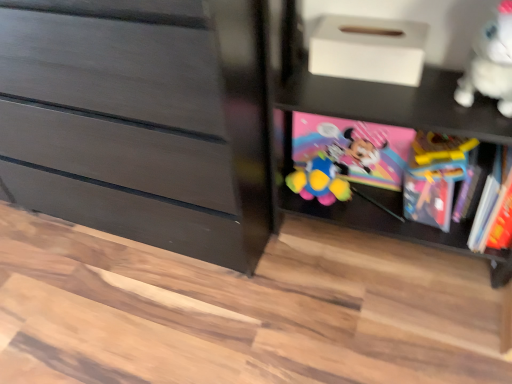
This screenshot has width=512, height=384. Describe the element at coordinates (354, 147) in the screenshot. I see `pink matte minnie mouse book at center, which is the first book from left to right` at that location.

Where is `black matte shelf at lower right`? The width and height of the screenshot is (512, 384). black matte shelf at lower right is located at coordinates (382, 94).

The height and width of the screenshot is (384, 512). Find the location of `translucent plastic book at right, which is the second book from left to right`. translucent plastic book at right, which is the second book from left to right is located at coordinates (434, 176).

At what (x,y) coordinates should I click in order to perform the action: click on matte black dresser at left. Please return your answer as a coordinate pair (x, y). The height and width of the screenshot is (384, 512). Looking at the image, I should click on (141, 128).

Locate an element on the screen. The height and width of the screenshot is (384, 512). pink matte minnie mouse book at center, which is the first book from left to right is located at coordinates (354, 147).

Is point (336, 22) positioned behind point (73, 126)?

Yes, point (336, 22) is behind point (73, 126).

Is white matte shoe box at upper center to the left of matte black dresser at left from the viewer's perspective?

In fact, white matte shoe box at upper center is to the right of matte black dresser at left.

From the image's perspective, between white matte shoe box at upper center and matte black dresser at left, who is located below?

matte black dresser at left.

Between matte black dresser at left and pink matte minnie mouse book at center, which is the first book from left to right, which one has more height?

With more height is matte black dresser at left.

From a real-world perspective, between matte black dresser at left and pink matte minnie mouse book at center, arranged as the second book when viewed from the right, who is vertically lower?

In real-world perspective, pink matte minnie mouse book at center, arranged as the second book when viewed from the right, is lower.

Is matte black dresser at left positioned in front of pink matte minnie mouse book at center, arranged as the second book when viewed from the right?

Yes, it is.

Which is closer to the camera, (350,78) or (393,169)?

Point (350,78).

This screenshot has height=384, width=512. I want to click on book that is the 1st object located below the white matte shoe box at upper center (from the image's perspective), so click(x=354, y=147).

Could you tell me if white matte shoe box at upper center is facing pink matte minnie mouse book at center, which is the first book from left to right?

No, white matte shoe box at upper center does not turn towards pink matte minnie mouse book at center, which is the first book from left to right.

From the picture: Which of these two, white plush toy at upper right or black matte shelf at lower right, is wider?

black matte shelf at lower right.

From a real-world perspective, does white plush toy at upper right stand above black matte shelf at lower right?

Indeed, from a real-world perspective, white plush toy at upper right stands above black matte shelf at lower right.

Is white plush toy at upper right shorter than black matte shelf at lower right?

Indeed, white plush toy at upper right has a lesser height compared to black matte shelf at lower right.

Is white plush toy at upper right positioned in front of black matte shelf at lower right?

No, the depth of white plush toy at upper right is greater than that of black matte shelf at lower right.

Can matte black dresser at left be found inside pink matte minnie mouse book at center, arranged as the second book when viewed from the right?

No, pink matte minnie mouse book at center, arranged as the second book when viewed from the right, does not contain matte black dresser at left.

What are the coordinates of `the 2nd book behind the matte black dresser at left, counting from the anchor's position` in the screenshot? It's located at (354, 147).

Between pink matte minnie mouse book at center, arranged as the second book when viewed from the right, and matte black dresser at left, which one appears on the left side from the viewer's perspective?

From the viewer's perspective, matte black dresser at left appears more on the left side.

From the image's perspective, between translucent plastic book at right, which ranks as the first book in right-to-left order, and matte black dresser at left, who is located below?

translucent plastic book at right, which ranks as the first book in right-to-left order.

Would you say translucent plastic book at right, which ranks as the first book in right-to-left order, is inside or outside matte black dresser at left?

The correct answer is: outside.

From the image's perspective, starting from the matte black dresser at left, which book is the 2nd one below? Please provide its 2D coordinates.

[(434, 176)]

Is white plush toy at upper right bigger or smaller than matte black dresser at left?

Considering their sizes, white plush toy at upper right takes up less space than matte black dresser at left.

I want to click on toy below the matte black dresser at left (from the image's perspective), so click(x=490, y=63).

Does white plush toy at upper right have a greater height compared to matte black dresser at left?

Incorrect, the height of white plush toy at upper right is not larger of that of matte black dresser at left.

Which object is positioned more to the right, white plush toy at upper right or matte black dresser at left?

Positioned to the right is white plush toy at upper right.

You are a GUI agent. You are given a task and a screenshot of the screen. Output one action in this format:
    pyautogui.click(x=<x>, y=<y>)
    Task: Click on the chest of drawers on the left of white matte shoe box at upper center
    The image size is (512, 384).
    Given the screenshot: What is the action you would take?
    pyautogui.click(x=141, y=128)

Where is `the chest of drawers that is above the pink matte minnie mouse book at center, which is the first book from left to right (from the image's perspective)`? the chest of drawers that is above the pink matte minnie mouse book at center, which is the first book from left to right (from the image's perspective) is located at coordinates (141, 128).

Estimate the real-world distances between objects in this image. Which object is further from matte black dresser at left, white plush toy at upper right or pink matte minnie mouse book at center, arranged as the second book when viewed from the right?

white plush toy at upper right is further to matte black dresser at left.

Which object lies nearer to the anchor point black matte shelf at lower right, white plush toy at upper right or matte black dresser at left?

white plush toy at upper right lies closer to black matte shelf at lower right than the other object.

Estimate the real-world distances between objects in this image. Which object is further from black matte shelf at lower right, translucent plastic book at right, which is the second book from left to right, or pink matte minnie mouse book at center, arranged as the second book when viewed from the right?

The object further to black matte shelf at lower right is translucent plastic book at right, which is the second book from left to right.

Which object lies nearer to the anchor point matte black dresser at left, white matte shoe box at upper center or white plush toy at upper right?

The object closer to matte black dresser at left is white matte shoe box at upper center.

Consider the image. Considering their positions, is white matte shoe box at upper center positioned further to translucent plastic book at right, which is the second book from left to right, than pink matte minnie mouse book at center, which is the first book from left to right?

white matte shoe box at upper center lies further to translucent plastic book at right, which is the second book from left to right, than the other object.

From the image, which object appears to be farther from matte black dresser at left, pink matte minnie mouse book at center, arranged as the second book when viewed from the right, or black matte shelf at lower right?

pink matte minnie mouse book at center, arranged as the second book when viewed from the right.

Estimate the real-world distances between objects in this image. Which object is closer to black matte shelf at lower right, white matte shoe box at upper center or white plush toy at upper right?

white matte shoe box at upper center is closer to black matte shelf at lower right.

Looking at the image, which one is located closer to translucent plastic book at right, which is the second book from left to right, pink matte minnie mouse book at center, which is the first book from left to right, or matte black dresser at left?

pink matte minnie mouse book at center, which is the first book from left to right, is positioned closer to the anchor translucent plastic book at right, which is the second book from left to right.

Locate an element on the screen. The width and height of the screenshot is (512, 384). toy between black matte shelf at lower right and pink matte minnie mouse book at center, which is the first book from left to right, along the z-axis is located at coordinates (490, 63).

Locate an element on the screen. book between matte black dresser at left and black matte shelf at lower right is located at coordinates (354, 147).

The image size is (512, 384). Find the location of `book between black matte shelf at lower right and pink matte minnie mouse book at center, which is the first book from left to right, along the z-axis`. book between black matte shelf at lower right and pink matte minnie mouse book at center, which is the first book from left to right, along the z-axis is located at coordinates (434, 176).

Image resolution: width=512 pixels, height=384 pixels. Identify the location of shelf situated between matte black dresser at left and white plush toy at upper right from left to right. (382, 94).